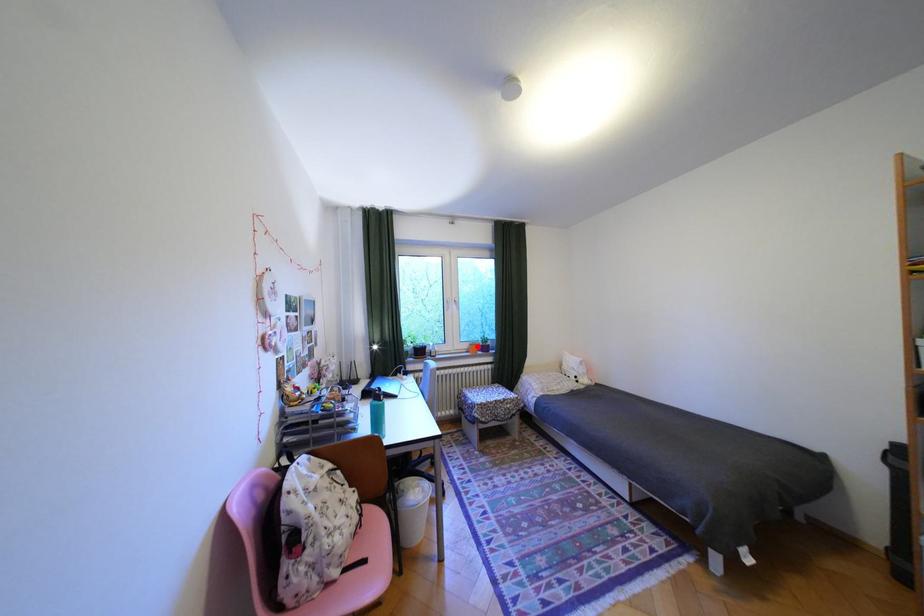
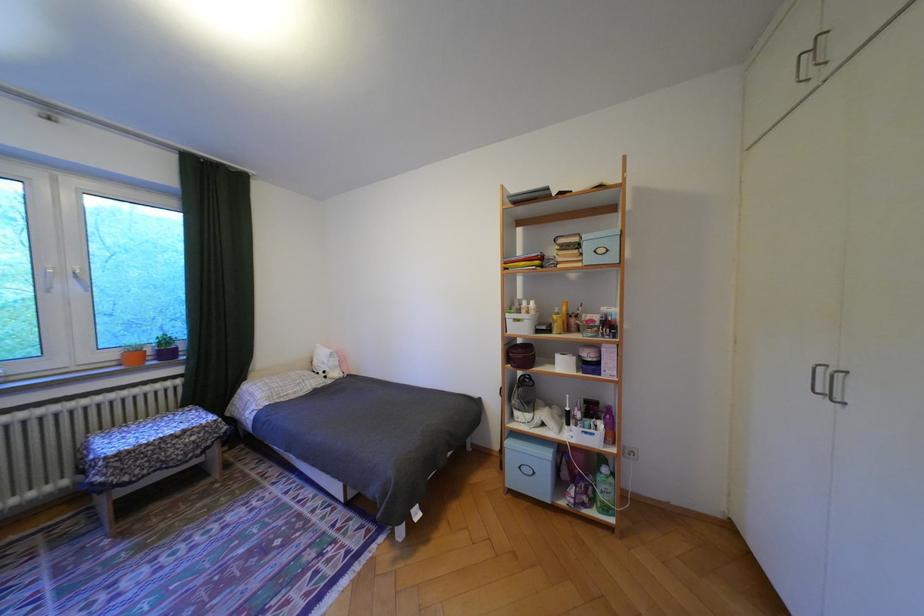
In the second image, find the point that corresponds to the highlighted location in the first image.

(124, 355)